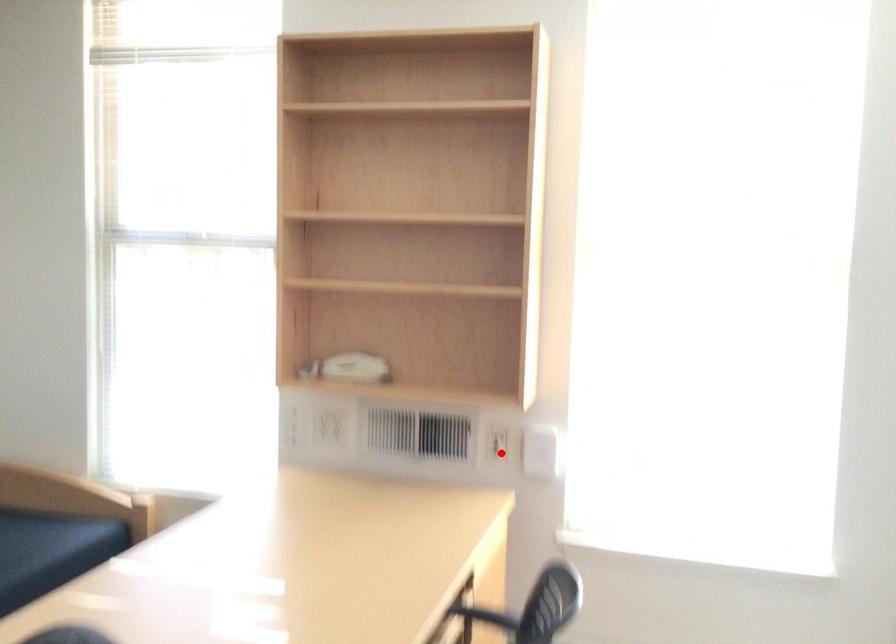
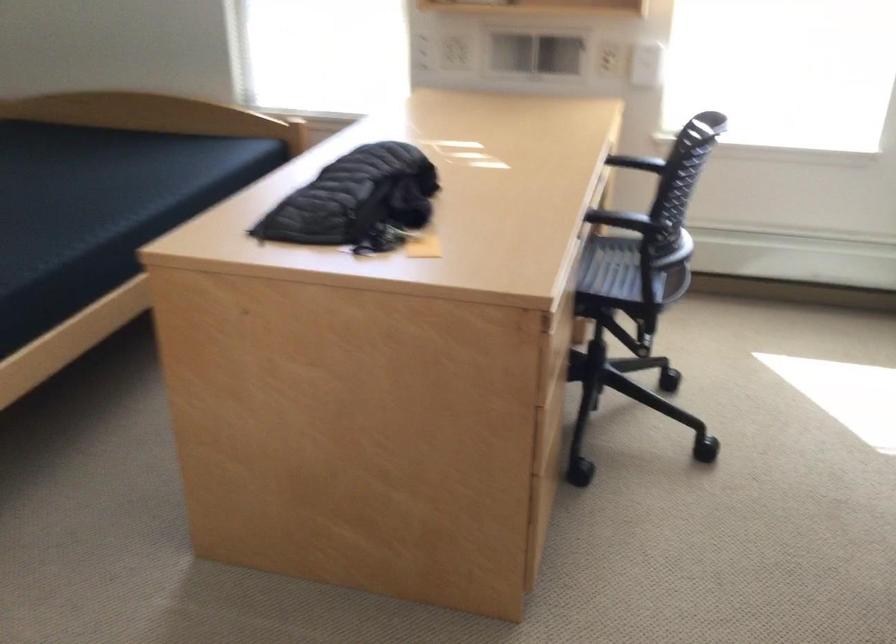
Locate, in the second image, the point that corresponds to the highlighted location in the first image.

(616, 62)